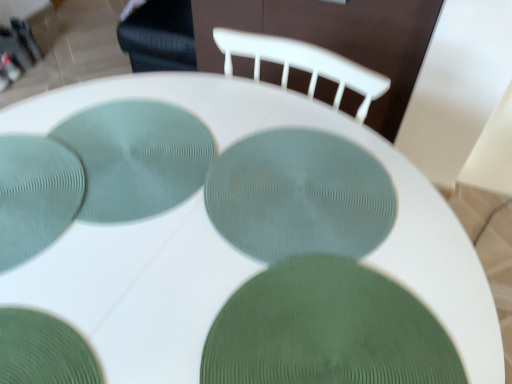
At what (x,y) coordinates should I click in order to perform the action: click on vacant space behind matte green plate at lower left, marked as the 5th glass plate in a right-to-left arrangement. Please return your answer as a coordinate pair (x, y). Image resolution: width=512 pixels, height=384 pixels. Looking at the image, I should click on (92, 111).